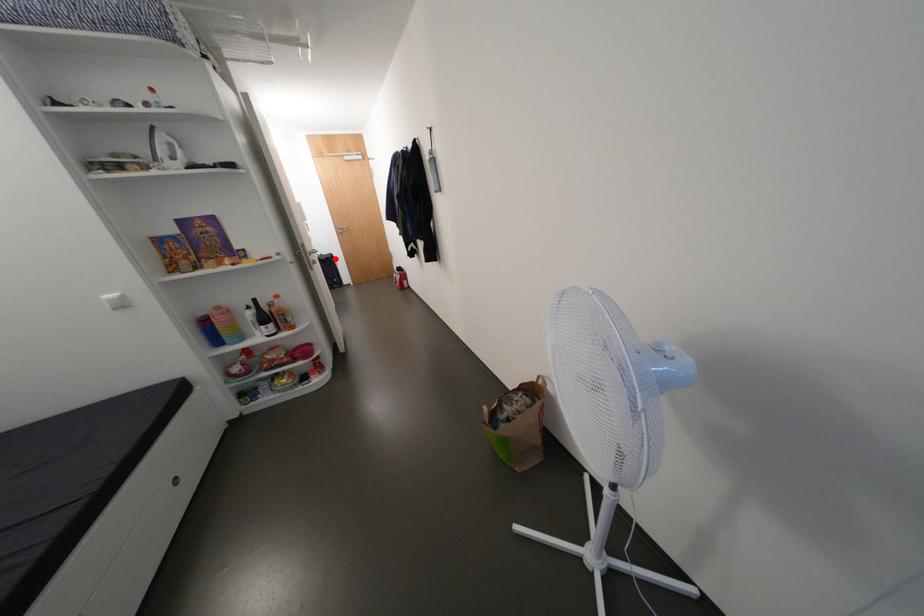
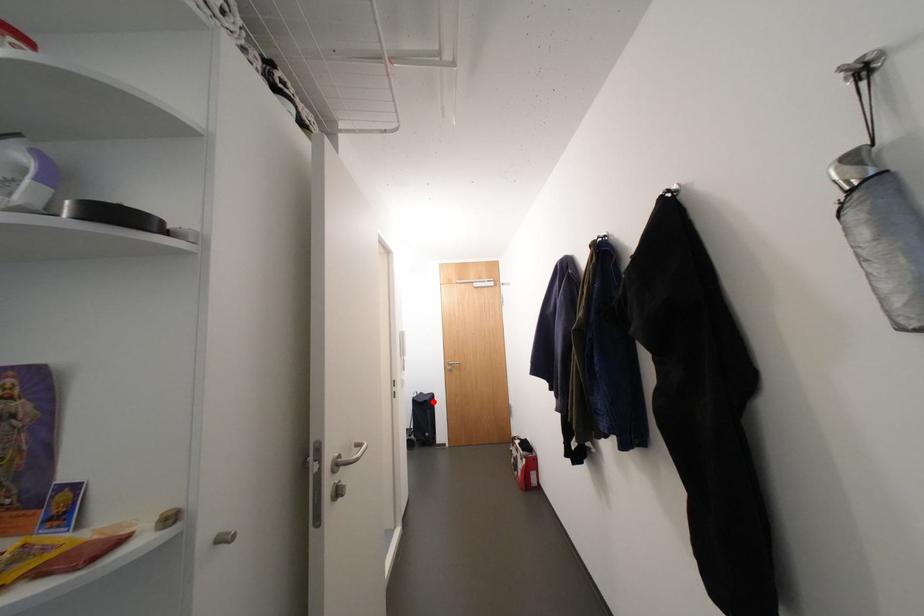
Based on the photo, I am providing you with two images of the same scene from different viewpoints. A red point is marked on the first image and another point is marked on the second image. Is the red point in image1 aligned with the point shown in image2?

Yes